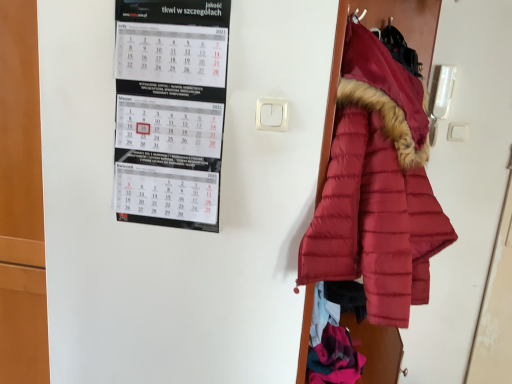
Question: Considering the relative sizes of white paper calendar at upper left and matte red puffer coat at right in the image provided, is white paper calendar at upper left thinner than matte red puffer coat at right?

Choices:
 (A) yes
 (B) no

Answer: (A)

Question: Is white paper calendar at upper left to the left of matte red puffer coat at right from the viewer's perspective?

Choices:
 (A) yes
 (B) no

Answer: (A)

Question: From the image's perspective, does white paper calendar at upper left appear lower than matte red puffer coat at right?

Choices:
 (A) yes
 (B) no

Answer: (B)

Question: Is white paper calendar at upper left far away from matte red puffer coat at right?

Choices:
 (A) no
 (B) yes

Answer: (A)

Question: Is matte red puffer coat at right completely or partially inside white paper calendar at upper left?

Choices:
 (A) no
 (B) yes

Answer: (A)

Question: Can you confirm if white paper calendar at upper left is bigger than matte red puffer coat at right?

Choices:
 (A) no
 (B) yes

Answer: (A)

Question: Would you say matte red puffer coat at right contains white paper calendar at upper left?

Choices:
 (A) no
 (B) yes

Answer: (A)

Question: Is matte red puffer coat at right closer to camera compared to white paper calendar at upper left?

Choices:
 (A) yes
 (B) no

Answer: (A)

Question: Considering the relative sizes of matte red puffer coat at right and white paper calendar at upper left in the image provided, is matte red puffer coat at right thinner than white paper calendar at upper left?

Choices:
 (A) no
 (B) yes

Answer: (A)

Question: Is matte red puffer coat at right oriented towards white paper calendar at upper left?

Choices:
 (A) no
 (B) yes

Answer: (A)

Question: Is matte red puffer coat at right at the left side of white paper calendar at upper left?

Choices:
 (A) no
 (B) yes

Answer: (A)

Question: Considering the relative positions of matte red puffer coat at right and white paper calendar at upper left in the image provided, is matte red puffer coat at right to the right of white paper calendar at upper left from the viewer's perspective?

Choices:
 (A) no
 (B) yes

Answer: (B)

Question: Does point (217, 28) appear closer or farther from the camera than point (376, 100)?

Choices:
 (A) closer
 (B) farther

Answer: (B)